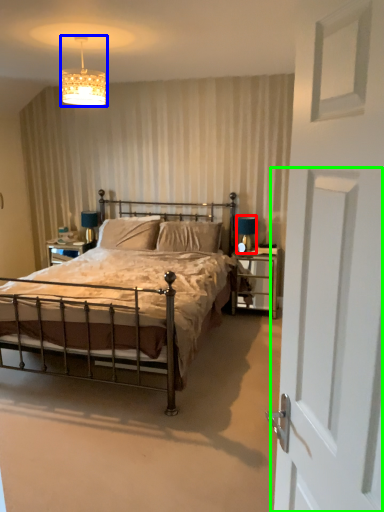
Question: Considering the real-world distances, which object is farthest from table lamp (highlighted by a red box)? lighting (highlighted by a blue box) or screen door (highlighted by a green box)?

Choices:
 (A) lighting
 (B) screen door

Answer: (B)